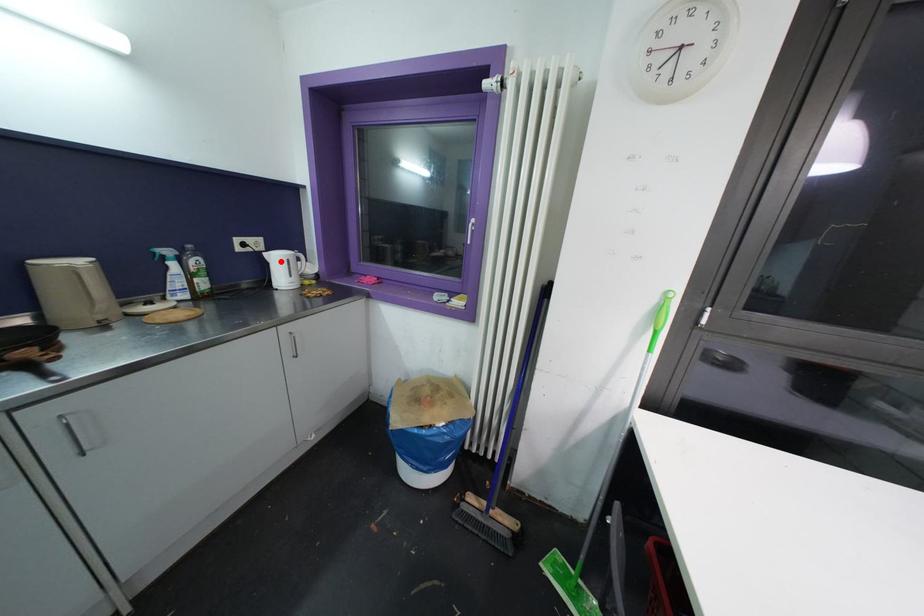
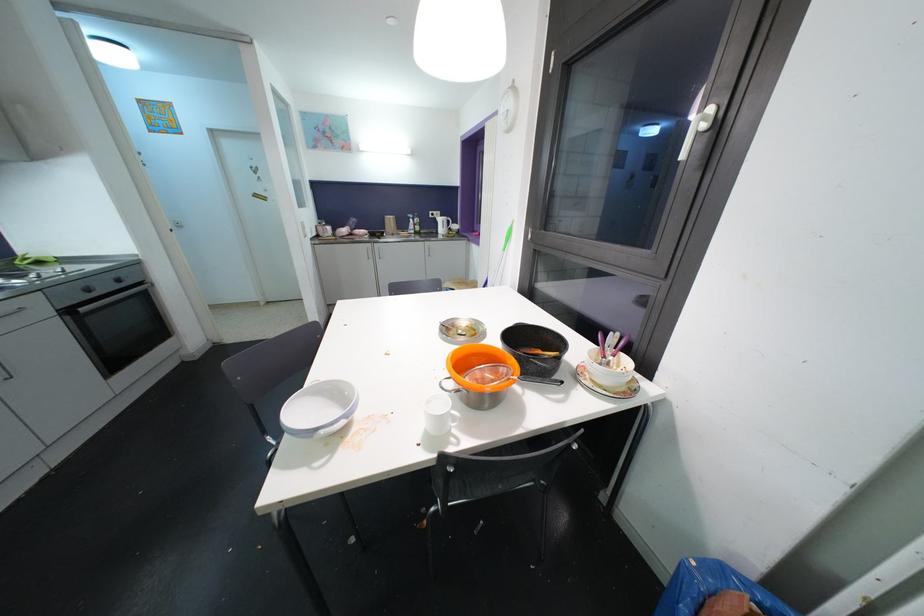
Question: I am providing you with two images of the same scene from different viewpoints. A red point is shown in image1. For the corresponding object point in image2, is it positioned nearer or farther from the camera?

Choices:
 (A) Nearer
 (B) Farther

Answer: (A)